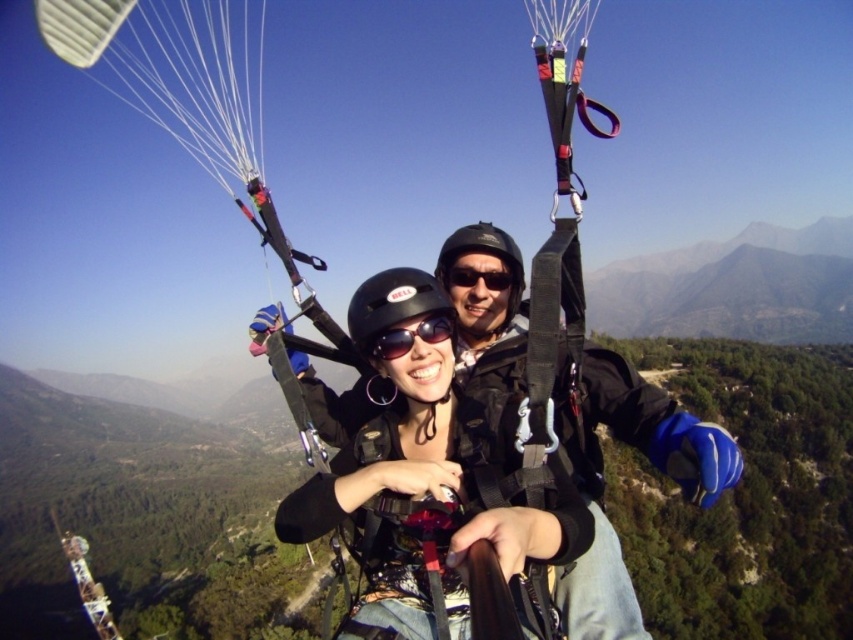
Question: Can you confirm if matte black helmet at center is wider than white fabric parachute at upper left?

Choices:
 (A) yes
 (B) no

Answer: (B)

Question: Which of the following is the farthest from the observer?

Choices:
 (A) matte black goggles at center
 (B) white fabric parachute at upper left

Answer: (B)

Question: Which object is farther from the camera taking this photo?

Choices:
 (A) black plastic goggles at center
 (B) matte black goggles at center
 (C) matte black helmet at center

Answer: (A)

Question: Is matte black helmet at center positioned at the back of black plastic goggles at center?

Choices:
 (A) no
 (B) yes

Answer: (A)

Question: Does matte black helmet at center have a greater width compared to black plastic goggles at center?

Choices:
 (A) no
 (B) yes

Answer: (B)

Question: Which of the following is the closest to the observer?

Choices:
 (A) white fabric parachute at upper left
 (B) black plastic goggles at center

Answer: (A)